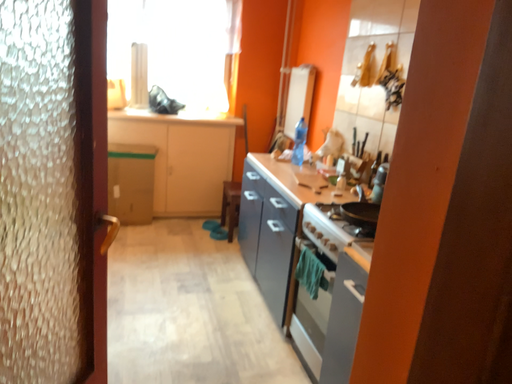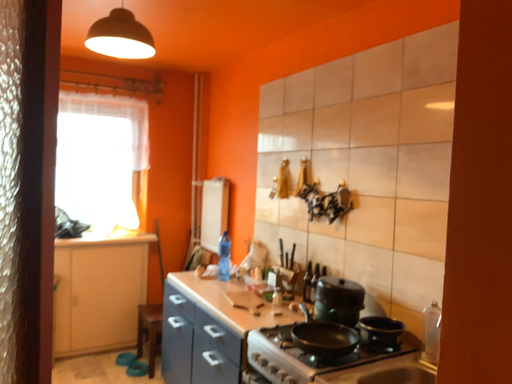
Question: Which way did the camera rotate in the video?

Choices:
 (A) rotated upward
 (B) rotated downward

Answer: (A)